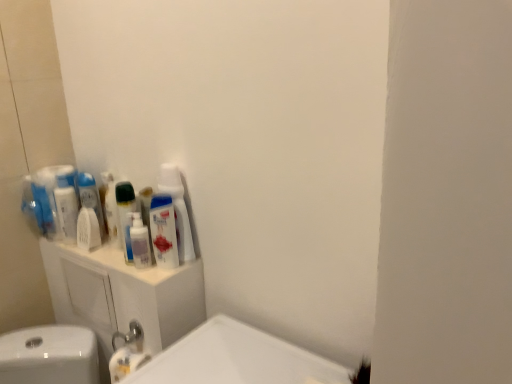
Question: Is point (90, 175) closer or farther from the camera than point (82, 218)?

Choices:
 (A) farther
 (B) closer

Answer: (A)

Question: In terms of height, does white glossy mouthwash at left, the fourth mouthwash positioned from the right, look taller or shorter compared to white matte mouthwash at left, the 3th mouthwash when ordered from left to right?

Choices:
 (A) tall
 (B) short

Answer: (A)

Question: Which object is positioned closest to the white glossy mouthwash at left, the fourth mouthwash positioned from the right?

Choices:
 (A) white matte mouthwash at left, placed as the 3th mouthwash when sorted from right to left
 (B) translucent plastic mouthwash at center, the second mouthwash positioned from the right
 (C) translucent plastic mouthwash at upper left, the 1th mouthwash viewed from the right
 (D) white plastic mouthwash at left, which is the 1th mouthwash from left to right
 (E) white plastic cabinet at upper left

Answer: (A)

Question: Which object is the farthest from the white plastic mouthwash at left, the 5th mouthwash when ordered from right to left?

Choices:
 (A) translucent plastic mouthwash at center, the second mouthwash positioned from the right
 (B) white matte mouthwash at left, placed as the 3th mouthwash when sorted from right to left
 (C) white glossy bottle at upper center
 (D) translucent plastic mouthwash at upper left, which is the fifth mouthwash in left-to-right order
 (E) white plastic cabinet at upper left

Answer: (D)